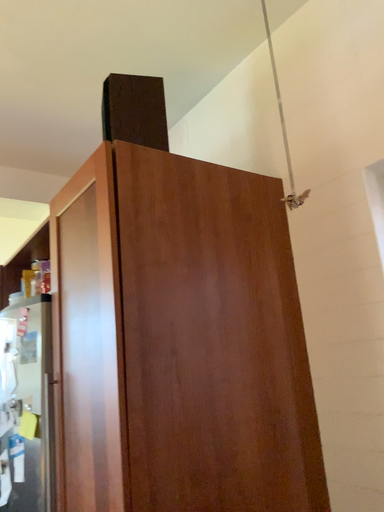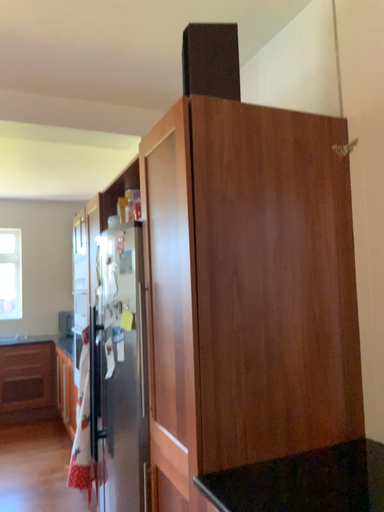
Question: Which way did the camera rotate in the video?

Choices:
 (A) rotated right
 (B) rotated left

Answer: (B)